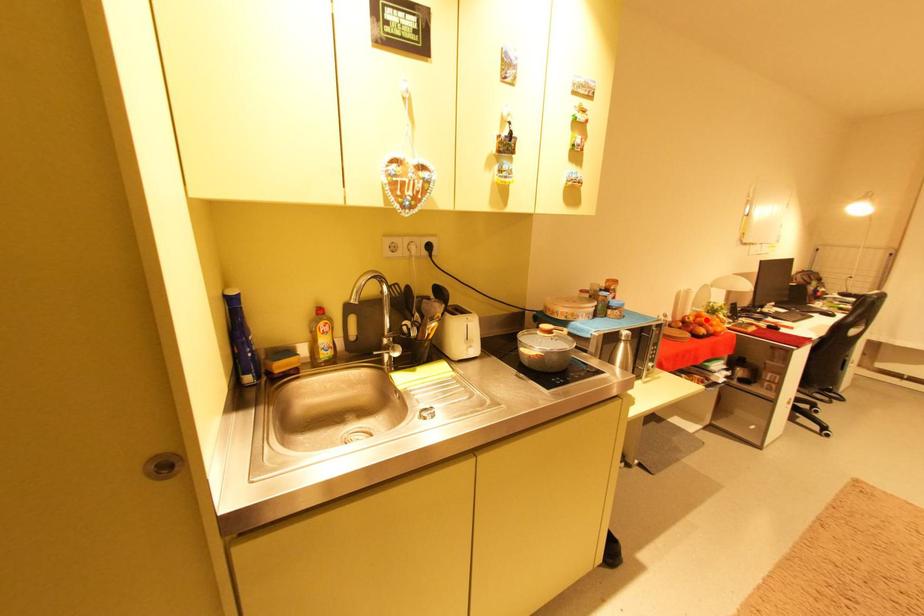
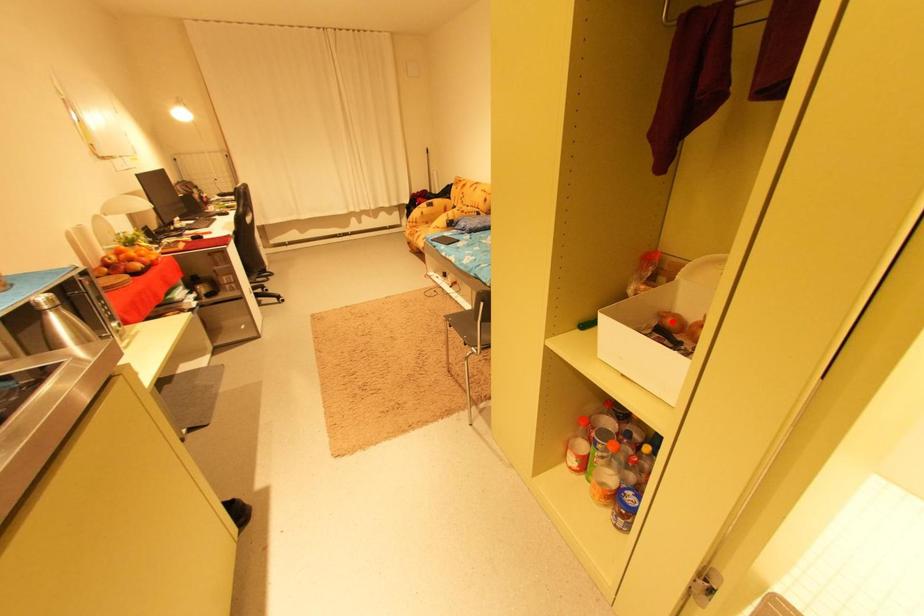
I am providing you with two images of the same scene from different viewpoints. A red point is marked on the first image and another point is marked on the second image. Are the points marked in image1 and image2 representing the same 3D position?

No